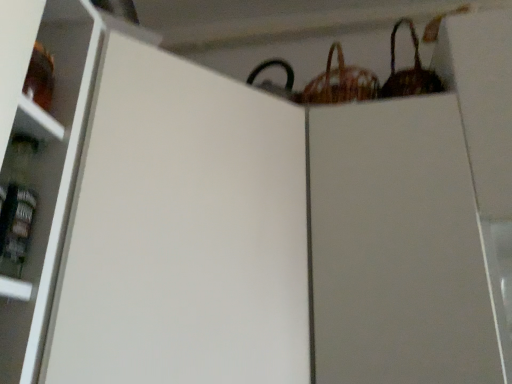
Question: From the image's perspective, is woven brown basket at upper right, the 2th basket from the left, above white matte cabinet at center?

Choices:
 (A) no
 (B) yes

Answer: (B)

Question: Is woven brown basket at upper right, arranged as the 1th basket when viewed from the right, positioned with its back to white matte cabinet at center?

Choices:
 (A) no
 (B) yes

Answer: (A)

Question: Considering the relative sizes of woven brown basket at upper right, the 2th basket from the left, and white matte cabinet at center in the image provided, is woven brown basket at upper right, the 2th basket from the left, taller than white matte cabinet at center?

Choices:
 (A) no
 (B) yes

Answer: (A)

Question: Is woven brown basket at upper right, the 2th basket from the left, positioned behind white matte cabinet at center?

Choices:
 (A) no
 (B) yes

Answer: (B)

Question: Is woven brown basket at upper right, arranged as the 1th basket when viewed from the right, wider than white matte cabinet at center?

Choices:
 (A) no
 (B) yes

Answer: (A)

Question: Considering the relative sizes of woven brown basket at upper right, the 2th basket from the left, and white matte cabinet at center in the image provided, is woven brown basket at upper right, the 2th basket from the left, smaller than white matte cabinet at center?

Choices:
 (A) yes
 (B) no

Answer: (A)

Question: Is woven brown basket at upper right, the first basket from the left, at the right side of woven brown basket at upper right, arranged as the 1th basket when viewed from the right?

Choices:
 (A) yes
 (B) no

Answer: (B)

Question: Can you confirm if woven brown basket at upper right, the 2th basket viewed from the right, is wider than woven brown basket at upper right, arranged as the 1th basket when viewed from the right?

Choices:
 (A) yes
 (B) no

Answer: (A)

Question: From the image's perspective, would you say woven brown basket at upper right, the first basket from the left, is positioned over woven brown basket at upper right, arranged as the 1th basket when viewed from the right?

Choices:
 (A) no
 (B) yes

Answer: (A)

Question: Considering the relative sizes of woven brown basket at upper right, the first basket from the left, and woven brown basket at upper right, arranged as the 1th basket when viewed from the right, in the image provided, is woven brown basket at upper right, the first basket from the left, smaller than woven brown basket at upper right, arranged as the 1th basket when viewed from the right,?

Choices:
 (A) no
 (B) yes

Answer: (A)

Question: From a real-world perspective, is woven brown basket at upper right, the first basket from the left, over woven brown basket at upper right, the 2th basket from the left?

Choices:
 (A) no
 (B) yes

Answer: (B)

Question: Is woven brown basket at upper right, the first basket from the left, oriented towards woven brown basket at upper right, the 2th basket from the left?

Choices:
 (A) yes
 (B) no

Answer: (B)

Question: Considering the relative positions of woven brown basket at upper right, the first basket from the left, and white matte cabinet at center in the image provided, is woven brown basket at upper right, the first basket from the left, to the left of white matte cabinet at center from the viewer's perspective?

Choices:
 (A) yes
 (B) no

Answer: (B)